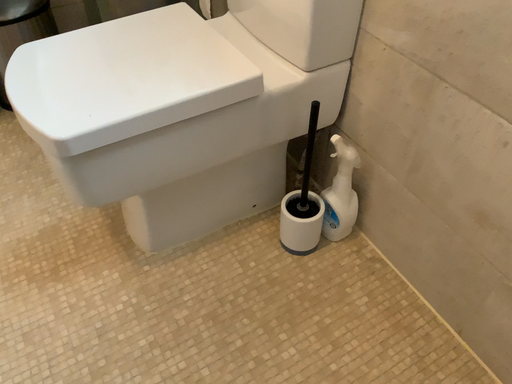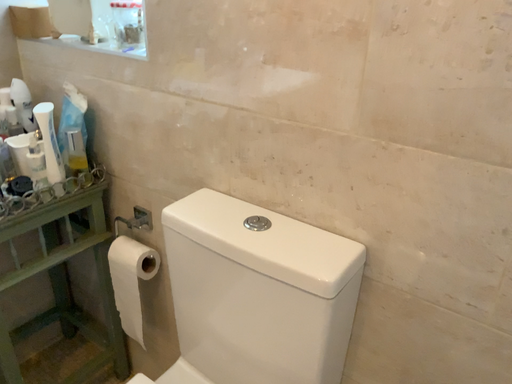
Question: How did the camera likely rotate when shooting the video?

Choices:
 (A) rotated left
 (B) rotated right

Answer: (B)